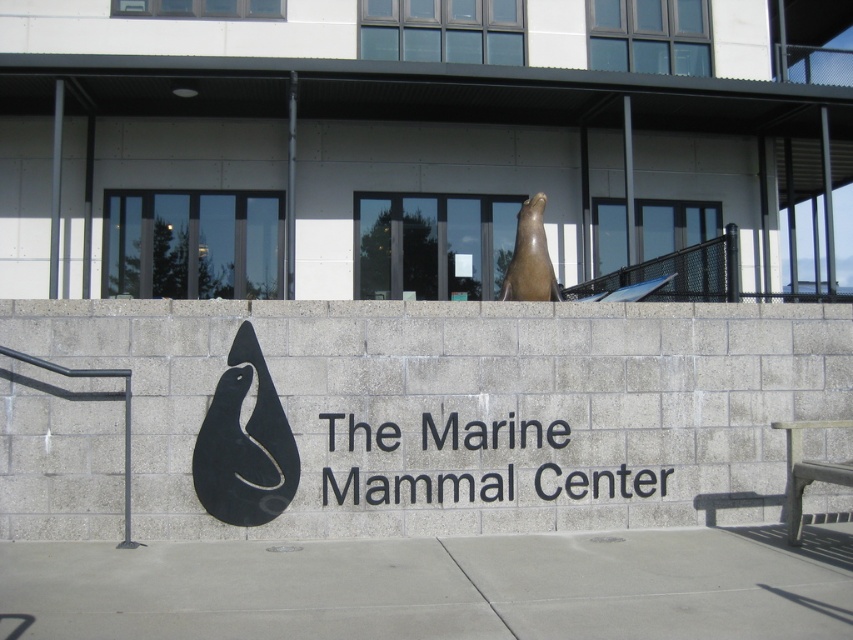
From the picture: Does black mesh railing at upper center have a lesser width compared to smooth gray bench at lower right?

No, black mesh railing at upper center is not thinner than smooth gray bench at lower right.

Where is `black mesh railing at upper center`? This screenshot has width=853, height=640. black mesh railing at upper center is located at coordinates click(679, 273).

Does point (737, 230) come farther from viewer compared to point (810, 474)?

Yes, it is behind point (810, 474).

Where is `black mesh railing at upper center`? The height and width of the screenshot is (640, 853). black mesh railing at upper center is located at coordinates (679, 273).

Does point (267, 416) lie in front of point (827, 461)?

Yes.

I want to click on black matte sculpture at center, so click(244, 444).

You are a GUI agent. You are given a task and a screenshot of the screen. Output one action in this format:
    pyautogui.click(x=<x>, y=<y>)
    Task: Click on the black mesh railing at upper center
    This screenshot has height=640, width=853.
    Given the screenshot: What is the action you would take?
    pyautogui.click(x=679, y=273)

Can you confirm if black mesh railing at upper center is positioned to the right of brown polished stone seal at center?

Correct, you'll find black mesh railing at upper center to the right of brown polished stone seal at center.

Does point (724, 250) come behind point (523, 234)?

No, (724, 250) is closer to viewer.

Locate an element on the screen. The image size is (853, 640). black mesh railing at upper center is located at coordinates (679, 273).